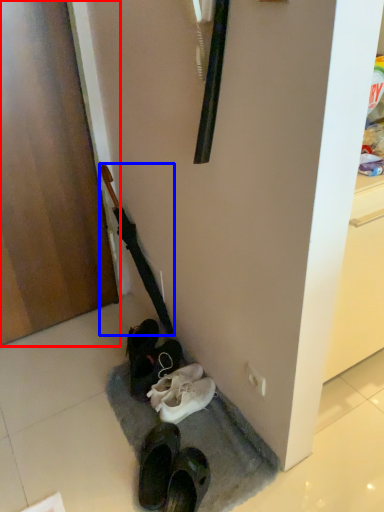
Question: Which object is closer to the camera taking this photo, door (highlighted by a red box) or umbrella (highlighted by a blue box)?

Choices:
 (A) door
 (B) umbrella

Answer: (A)